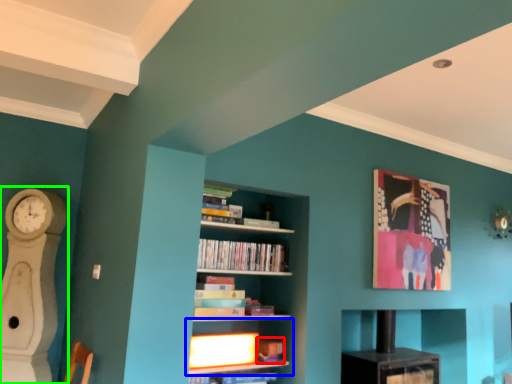
Question: Considering the real-world distances, which object is closest to book (highlighted by a red box)? shelf (highlighted by a blue box) or fireplace (highlighted by a green box).

Choices:
 (A) shelf
 (B) fireplace

Answer: (A)